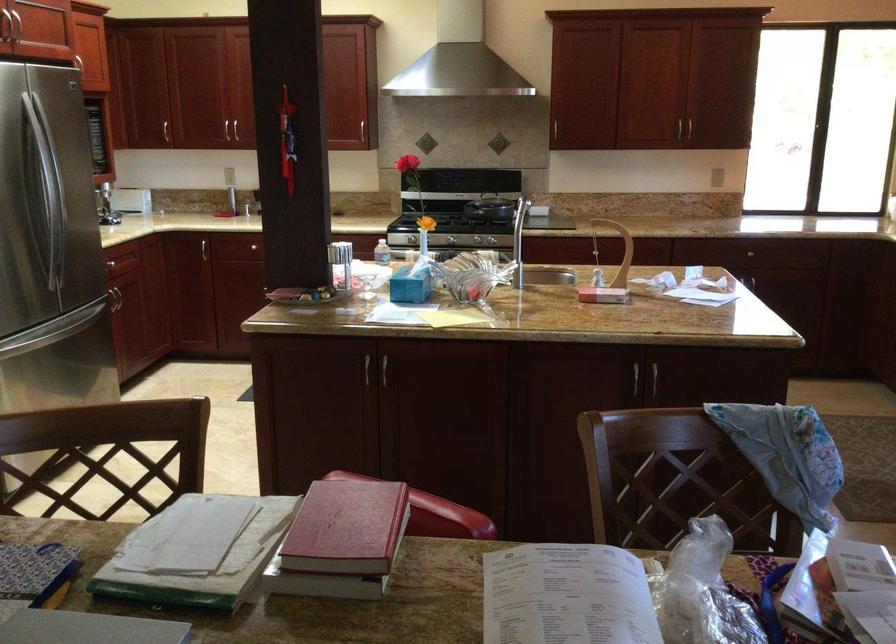
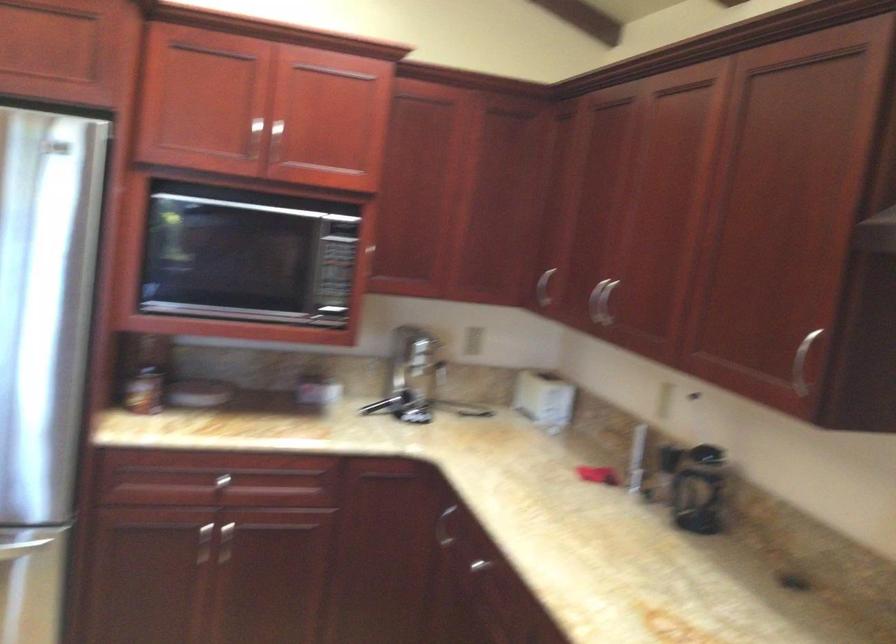
Locate, in the second image, the point that corresponds to pixel 113 122 in the first image.

(544, 287)